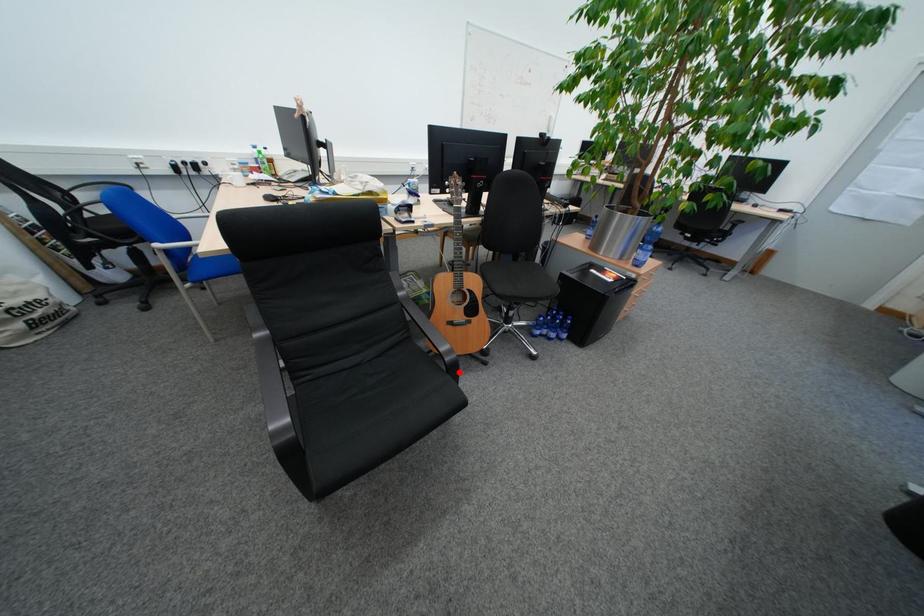
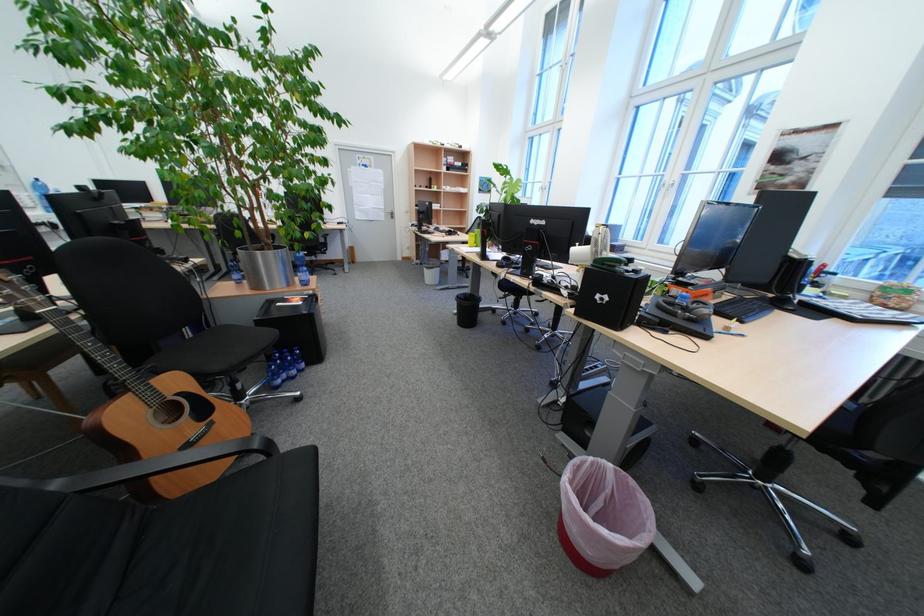
Question: I am providing you with two images of the same scene from different viewpoints. A red point is marked on the first image. Can you still see the location of the red point in image 2?

Choices:
 (A) Yes
 (B) No

Answer: (A)